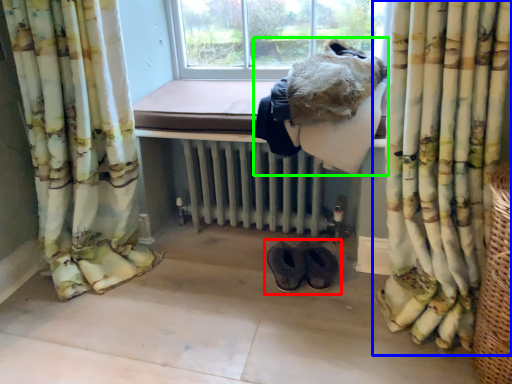
Question: Which is farther away from footwear (highlighted by a red box)? curtain (highlighted by a blue box) or animal (highlighted by a green box)?

Choices:
 (A) curtain
 (B) animal

Answer: (B)